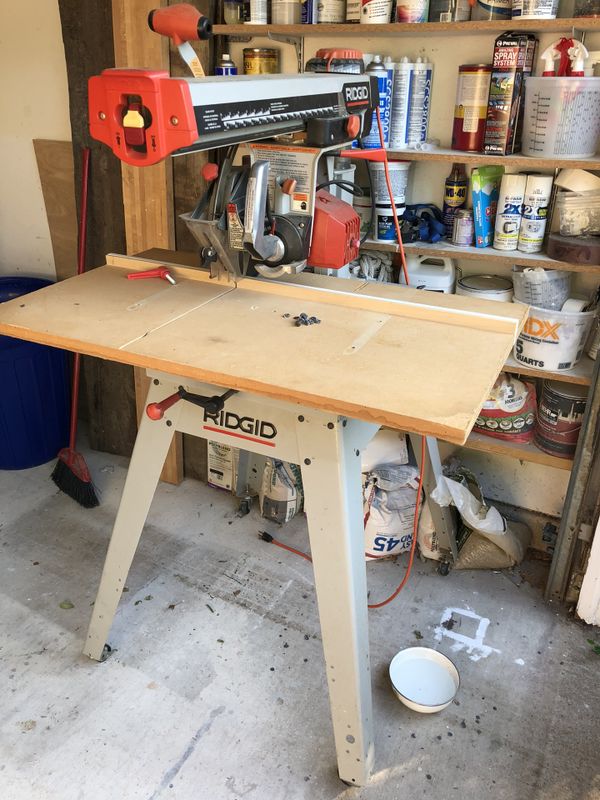
Find the location of `cord`. cord is located at coordinates (400, 238).